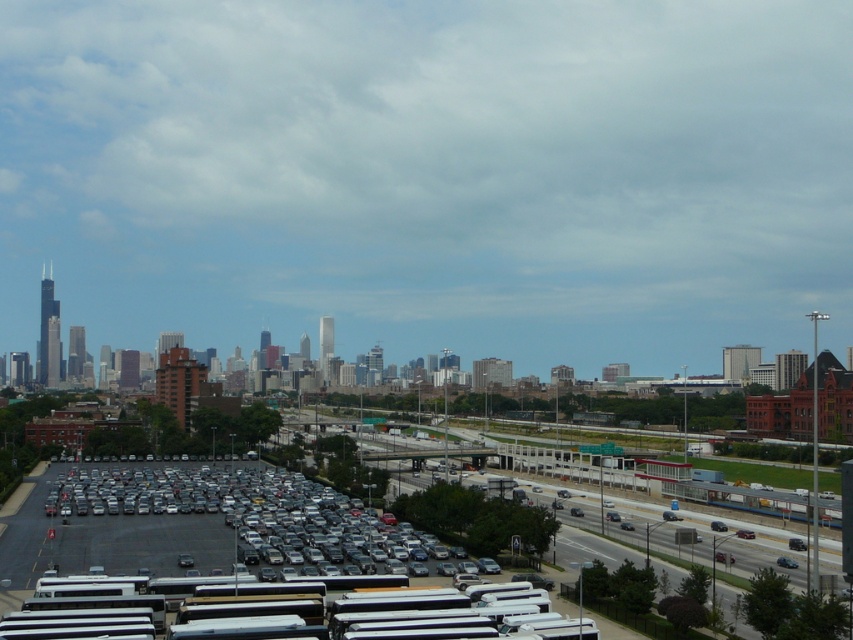
Can you confirm if matte black car at lower left is positioned to the right of matte silver sedan at center?

No, matte black car at lower left is not to the right of matte silver sedan at center.

Does matte black car at lower left have a smaller size compared to matte silver sedan at center?

No, matte black car at lower left is not smaller than matte silver sedan at center.

Which is in front, point (372, 513) or point (746, 534)?

Point (746, 534) is more forward.

Identify the location of matte black car at lower left. (241, 513).

You are a GUI agent. You are given a task and a screenshot of the screen. Output one action in this format:
    pyautogui.click(x=<x>, y=<y>)
    Task: Click on the metallic gray cars at lower center
    The height and width of the screenshot is (640, 853).
    Given the screenshot: What is the action you would take?
    pyautogui.click(x=273, y=563)

Between metallic gray cars at lower center and metallic blue sedan at center, which one appears on the right side from the viewer's perspective?

metallic blue sedan at center is more to the right.

Where is `metallic gray cars at lower center`? metallic gray cars at lower center is located at coordinates (273, 563).

Who is lower down, metallic gray cars at lower center or matte silver sedan at center?

matte silver sedan at center

Does point (271, 502) come behind point (735, 531)?

Yes, it is.

This screenshot has height=640, width=853. I want to click on metallic gray cars at lower center, so click(x=273, y=563).